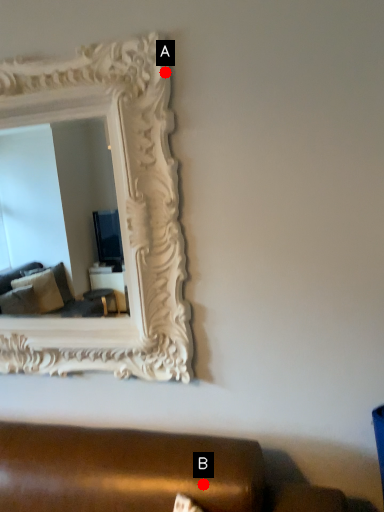
Question: Two points are circled on the image, labeled by A and B beside each circle. Among these points, which one is nearest to the camera?

Choices:
 (A) A is closer
 (B) B is closer

Answer: (B)